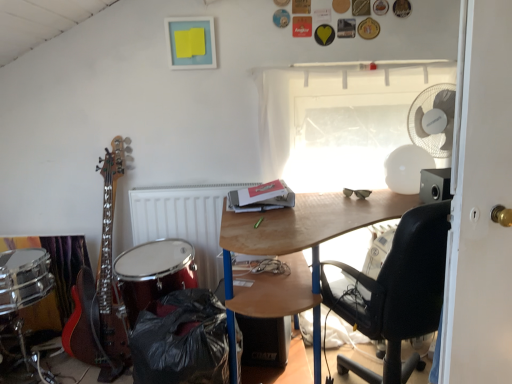
At what (x,y) coordinates should I click in order to perform the action: click on free space above transparent plastic window at upper center (from a real-world perspective). Please return your answer as a coordinate pair (x, y). Image resolution: width=512 pixels, height=384 pixels. Looking at the image, I should click on (366, 56).